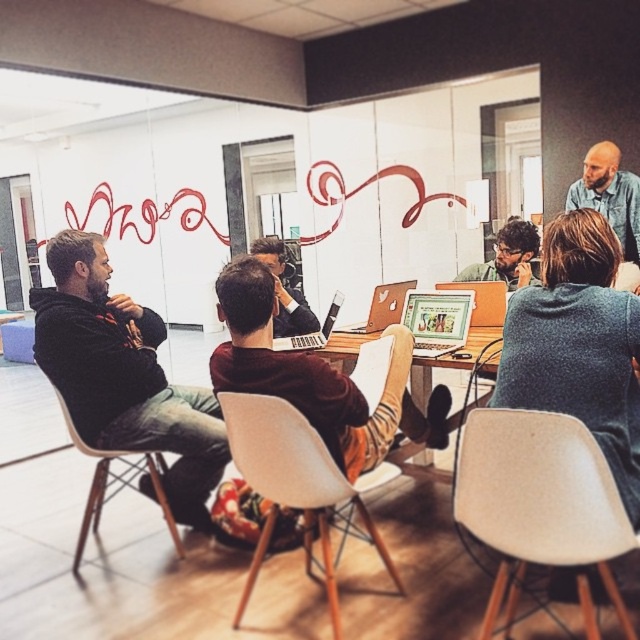
You are a delivery person who needs to place a small package between the white plastic chair at left and the matte silver laptop at center. The package requires 2 meters of space to be placed safely. Can you fit it there?

The white plastic chair at left and matte silver laptop at center are 1.96 meters apart, which is less than the required 2 meters. Therefore, the package cannot be placed safely between them.